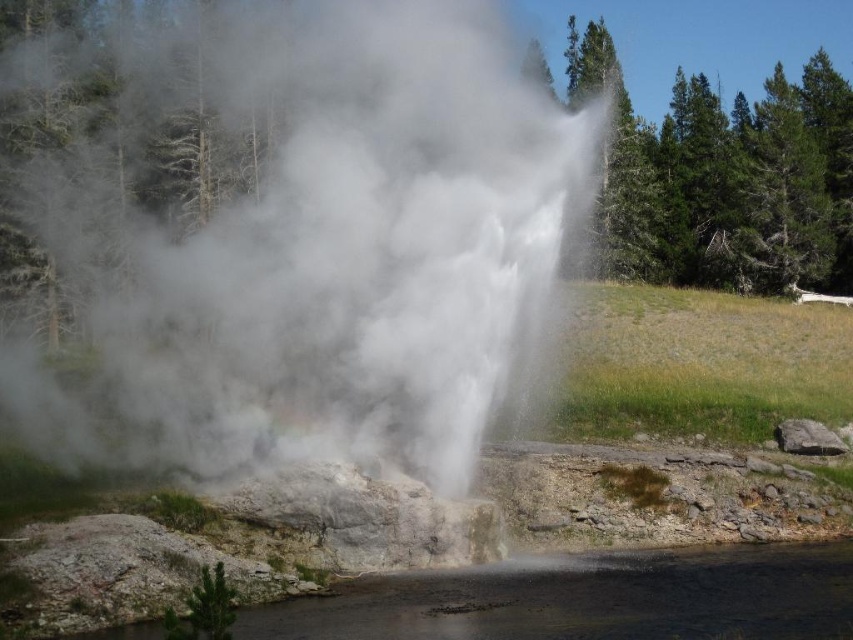
Is point (479, 112) positioned in front of point (251, 621)?

No, (479, 112) is behind (251, 621).

Is white vapor at center thinner than clear water at lower center?

Incorrect, white vapor at center's width is not less than clear water at lower center's.

Identify the location of white vapor at center. This screenshot has height=640, width=853. (299, 236).